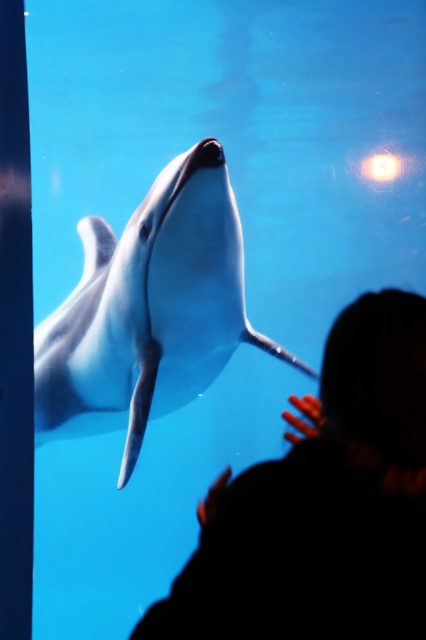
Question: Which point is closer to the camera?

Choices:
 (A) (291, 556)
 (B) (242, 296)

Answer: (A)

Question: Is silhouette hair at upper center in front of white smooth dolphin at center?

Choices:
 (A) no
 (B) yes

Answer: (B)

Question: Which of the following is the closest to the observer?

Choices:
 (A) (362, 465)
 (B) (40, 394)

Answer: (A)

Question: Does silhouette hair at upper center have a lesser width compared to white smooth dolphin at center?

Choices:
 (A) yes
 (B) no

Answer: (A)

Question: Is silhouette hair at upper center closer to camera compared to white smooth dolphin at center?

Choices:
 (A) yes
 (B) no

Answer: (A)

Question: Which point is farther from the camera taking this photo?

Choices:
 (A) (336, 588)
 (B) (86, 387)

Answer: (B)